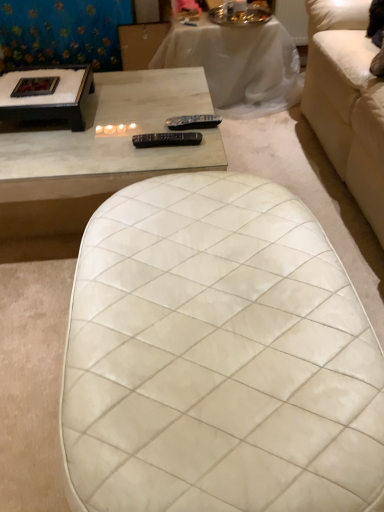
The width and height of the screenshot is (384, 512). Identify the location of vacant region in front of black plastic remote at center, the 2th remote in the back-to-front sequence. (164, 162).